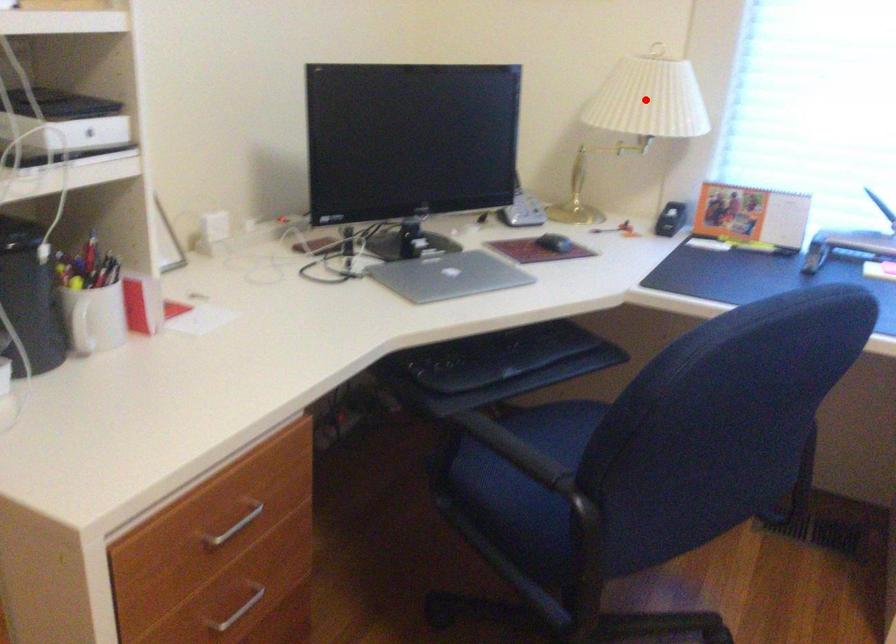
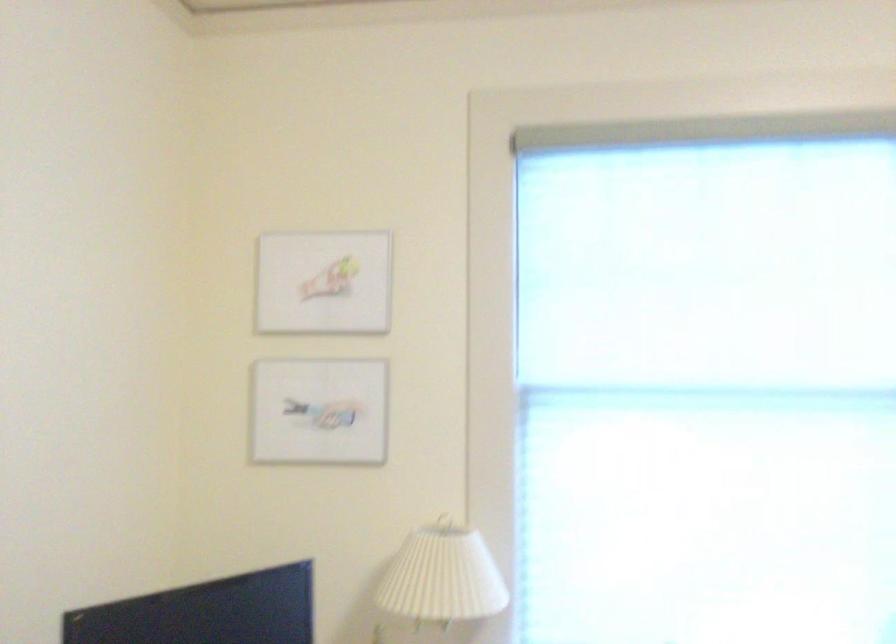
The point at the highlighted location is marked in the first image. Where is the corresponding point in the second image?

(443, 576)